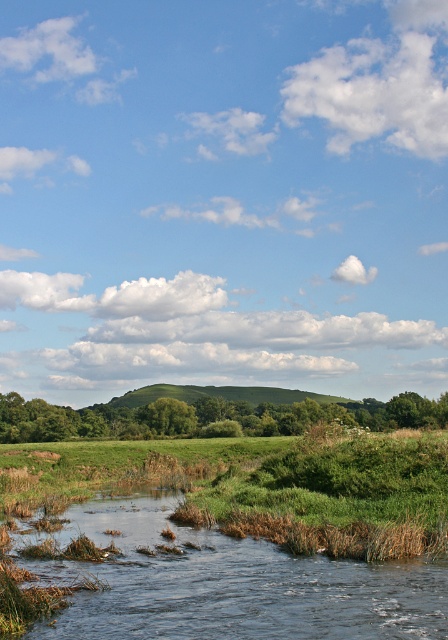
Question: Is clear water at lower left wider than green leafy hill at center?

Choices:
 (A) yes
 (B) no

Answer: (B)

Question: In this image, where is clear water at lower left located relative to green leafy hill at center?

Choices:
 (A) right
 (B) left

Answer: (A)

Question: Which object is farther from the camera taking this photo?

Choices:
 (A) green leafy hill at center
 (B) clear water at lower left

Answer: (A)

Question: Does clear water at lower left have a larger size compared to green leafy hill at center?

Choices:
 (A) yes
 (B) no

Answer: (B)